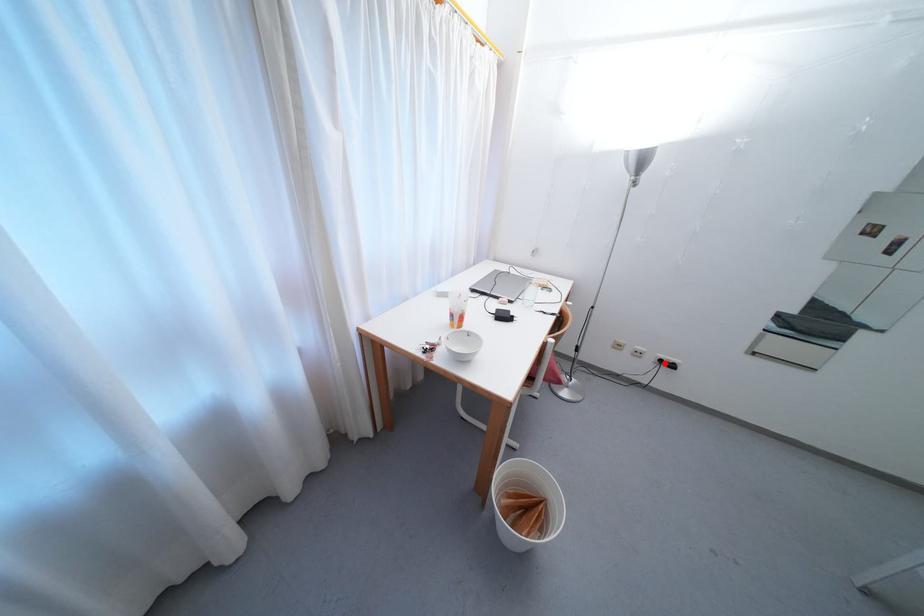
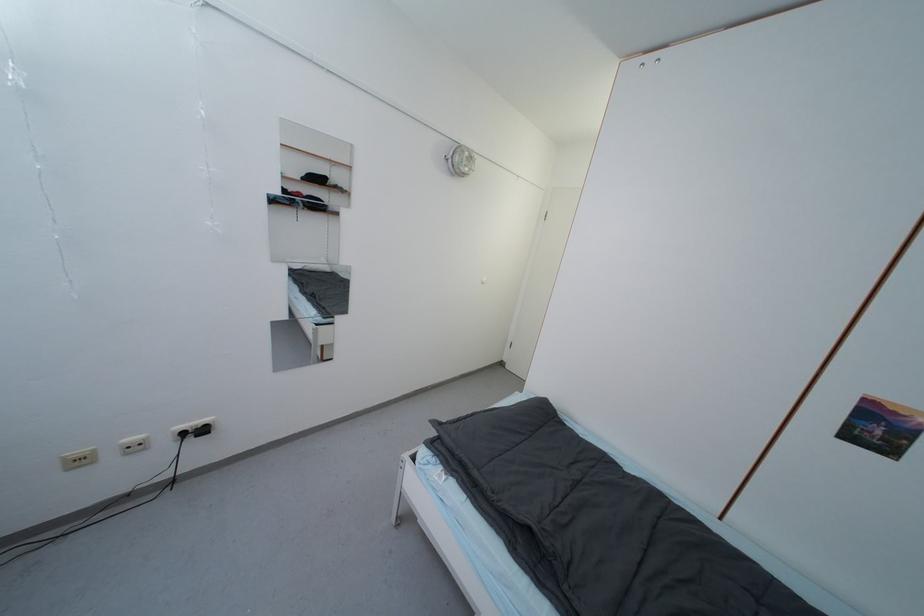
Where in the second image is the point corresponding to the highlighted location from the first image?

(187, 436)